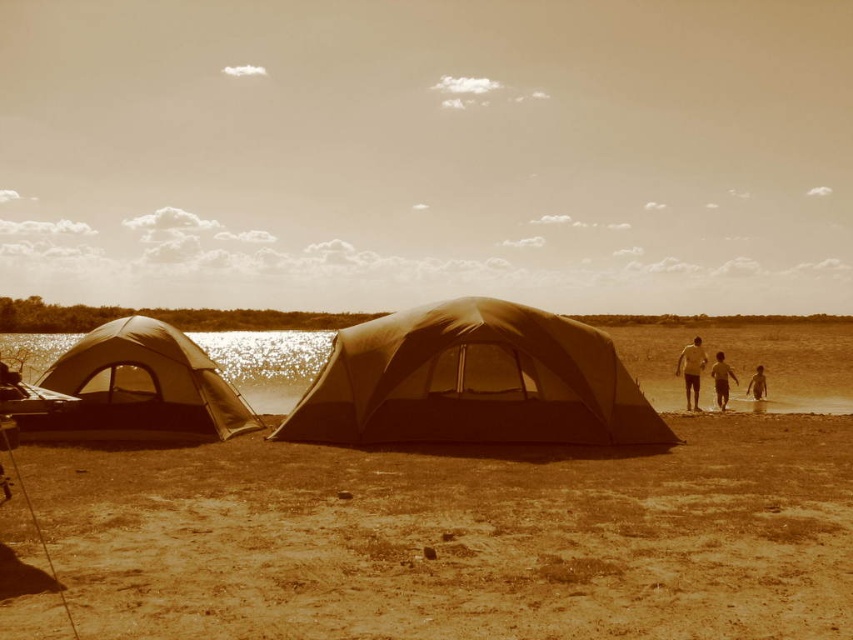
You are planning to set up a small tent in the camping scene. The tent requires a flat area larger than the brown textured sand at lower right. Can the translucent water at center provide enough space for your tent?

The translucent water at center is bigger than the brown textured sand at lower right, so yes, the translucent water at center can provide enough space for your tent.

You are a hiker who wants to cross the area between the two tents. You notice the translucent water at center and the brown textured sand at lower right. Which path should you choose to avoid getting your feet wet?

You should choose the brown textured sand at lower right because the translucent water at center is much taller and would likely get your feet wet.

You are standing at the camera position and want to place a small flag exactly at the point closer to you between the two points labeled point (x=776, y=348) and point (x=724, y=371). Which point should you choose?

You should choose point (x=776, y=348) because it is closer to the camera than point (x=724, y=371).